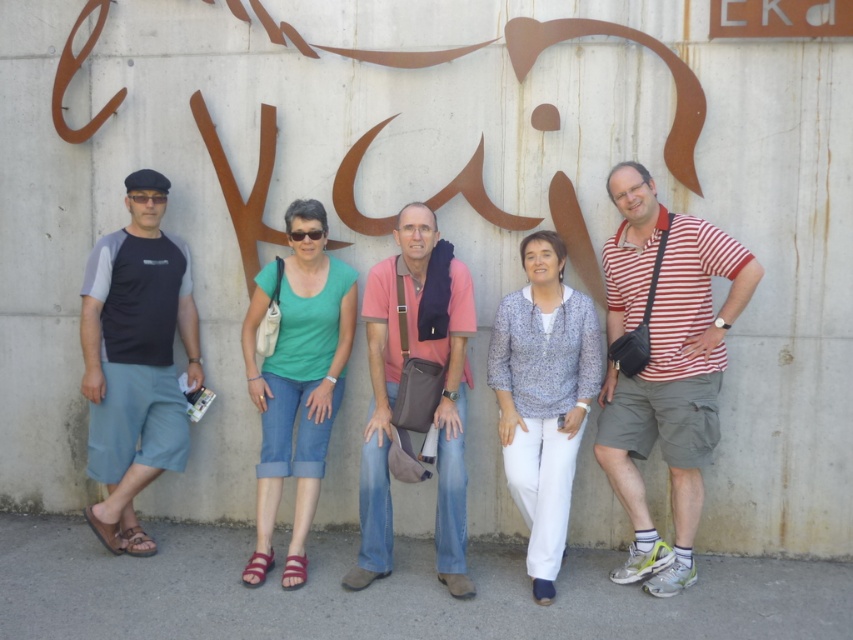
Question: Does matte green shirt at center appear over patterned fabric blouse at center?

Choices:
 (A) no
 (B) yes

Answer: (B)

Question: Is striped cotton shirt at center to the left of gray-blue fabric shorts at left from the viewer's perspective?

Choices:
 (A) yes
 (B) no

Answer: (B)

Question: Which object is the closest to the patterned fabric blouse at center?

Choices:
 (A) striped cotton shirt at center
 (B) pink fabric shirt at center
 (C) gray-blue fabric shorts at left

Answer: (A)

Question: Which point is closer to the camera?

Choices:
 (A) (444, 246)
 (B) (315, 452)
 (C) (582, 316)
 (D) (682, 451)

Answer: (D)

Question: Among these points, which one is farthest from the camera?

Choices:
 (A) (463, 448)
 (B) (251, 330)
 (C) (643, 394)
 (D) (190, 300)

Answer: (D)

Question: Is gray-blue fabric shorts at left positioned in front of patterned fabric blouse at center?

Choices:
 (A) yes
 (B) no

Answer: (B)